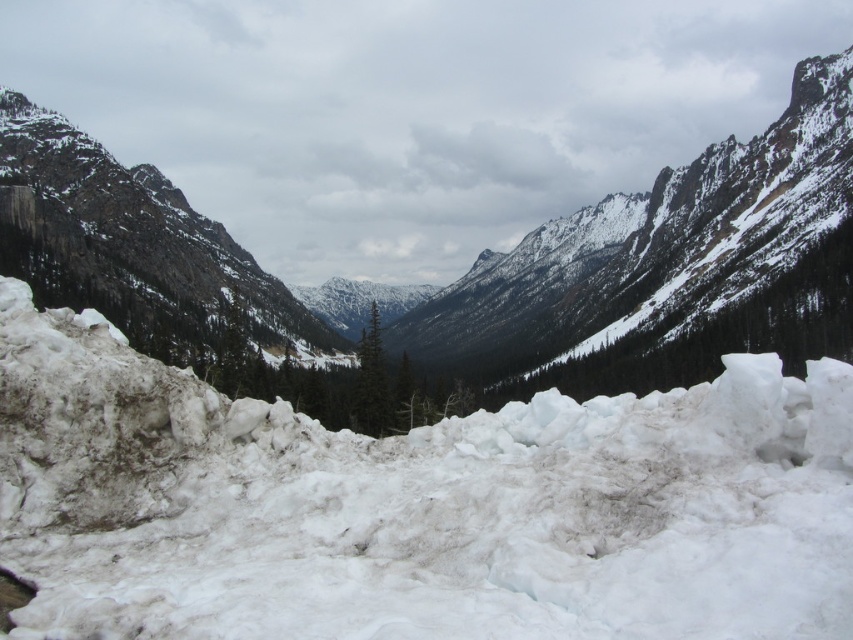
Based on the photo, you are planning a hiking route through the mountainous landscape and need to cross the white frosty snow at center. Based on the provided coordinates, would you recommend this area as a safe path for hikers?

The white frosty snow at center is located at point (415, 506), which might indicate its position relative to other terrain features. However, without additional information about the stability of the snow or potential hazards like crevasses, it is not possible to determine safety solely from coordinates. Hikers should consult local experts or use proper safety gear.

You are a hiker planning to cross the white frosty snow at center and the snowy rock at lower left. Which path would be safer to avoid slipping? Please consider the surface conditions described in the scene.

The white frosty snow at center has a rough and uneven texture with melting or slushy areas, making it more slippery than the snowy rock at lower left. Therefore, the snowy rock at lower left would be a safer path to avoid slipping.

You are an explorer trying to cross the snow in the image. You see the white frosty snow at center and the snowy rock at lower left. Which one is located more to the left?

The white frosty snow at center is positioned on the left side of snowy rock at lower left, so it is more to the left.